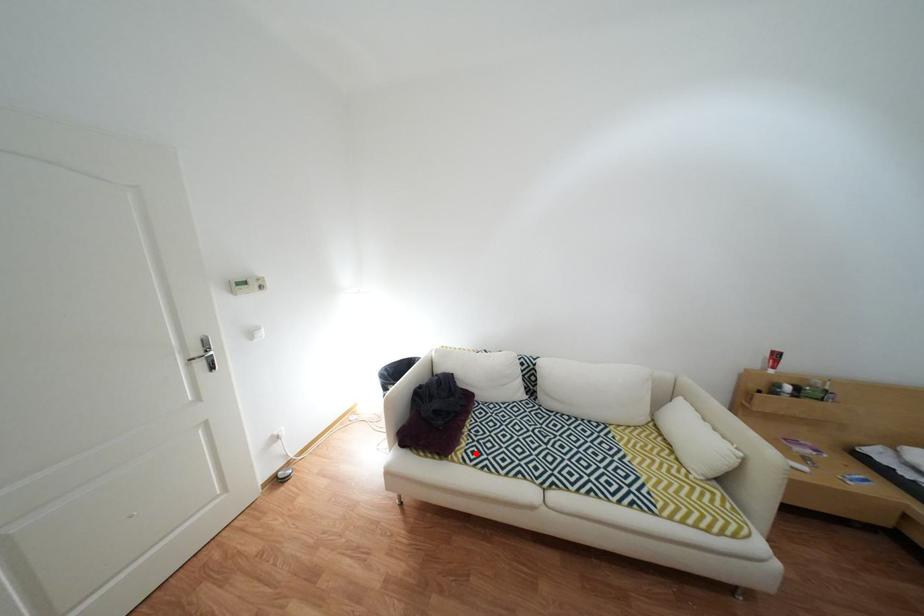
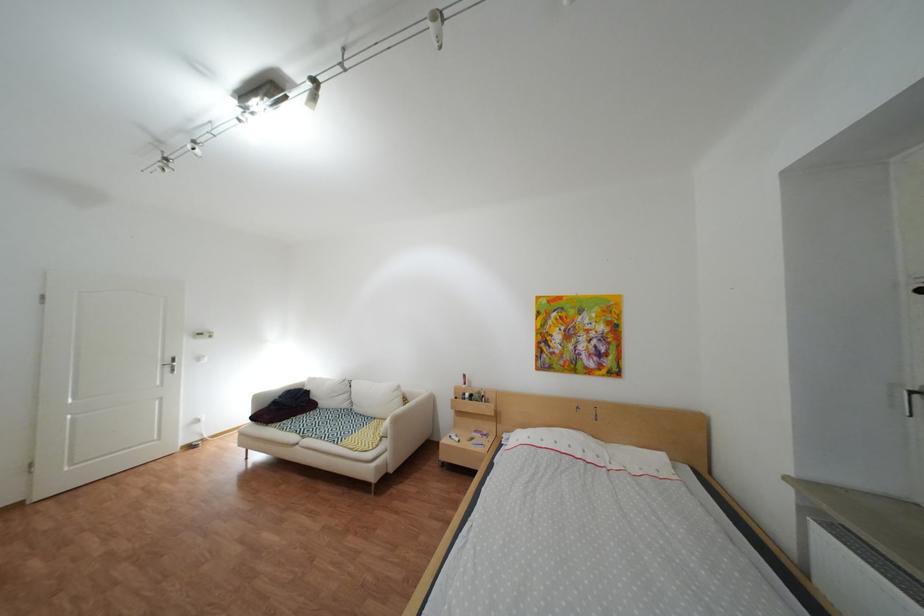
The point at the highlighted location is marked in the first image. Where is the corresponding point in the second image?

(294, 424)